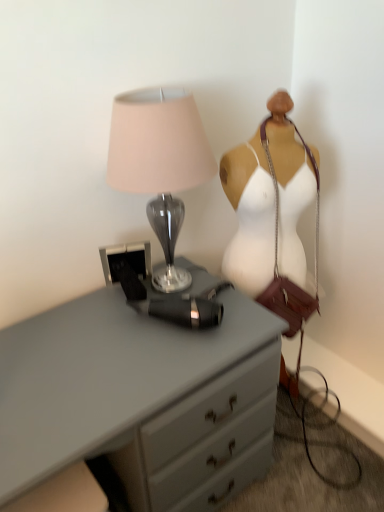
Image resolution: width=384 pixels, height=512 pixels. I want to click on empty space that is ontop of matte gray chest of drawers at center (from a real-world perspective), so click(x=107, y=348).